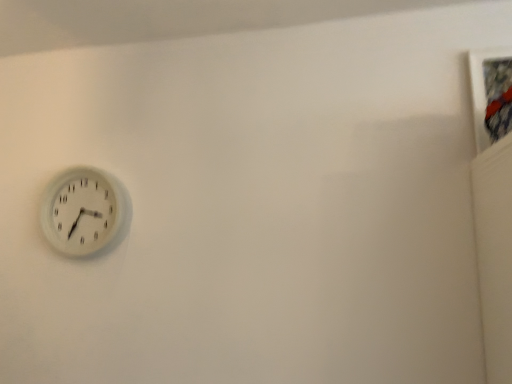
Question: Is point (479, 72) positioned closer to the camera than point (60, 244)?

Choices:
 (A) closer
 (B) farther

Answer: (A)

Question: From a real-world perspective, relative to white plastic wall clock at left, is textured fabric picture frame at upper right vertically above or below?

Choices:
 (A) below
 (B) above

Answer: (B)

Question: From the image's perspective, is textured fabric picture frame at upper right located above or below white plastic wall clock at left?

Choices:
 (A) below
 (B) above

Answer: (B)

Question: Is white plastic wall clock at left bigger or smaller than textured fabric picture frame at upper right?

Choices:
 (A) small
 (B) big

Answer: (B)

Question: From the image's perspective, is white plastic wall clock at left positioned above or below textured fabric picture frame at upper right?

Choices:
 (A) above
 (B) below

Answer: (B)

Question: Is point (54, 195) closer or farther from the camera than point (476, 89)?

Choices:
 (A) closer
 (B) farther

Answer: (B)

Question: Is white plastic wall clock at left in front of or behind textured fabric picture frame at upper right in the image?

Choices:
 (A) behind
 (B) front

Answer: (A)